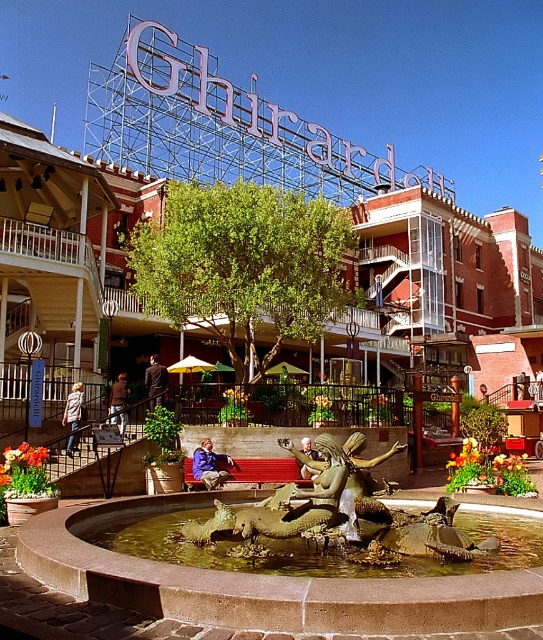
Who is higher up, red brick building at center or denim jacket at lower left?

red brick building at center is above.

Where is `red brick building at center`? red brick building at center is located at coordinates (72, 252).

In the scene shown: Is dark brown leather jacket at center to the left of brown leather jacket at lower center from the viewer's perspective?

No, dark brown leather jacket at center is not to the left of brown leather jacket at lower center.

Is dark brown leather jacket at center above brown leather jacket at lower center?

Yes, dark brown leather jacket at center is above brown leather jacket at lower center.

Does point (167, 378) come in front of point (118, 390)?

No, it is behind (118, 390).

What are the coordinates of `dark brown leather jacket at center` in the screenshot? It's located at (155, 380).

Which is more to the right, denim jacket at lower left or smooth leather jacket at center?

Positioned to the right is smooth leather jacket at center.

Who is more distant from viewer, (66, 417) or (301, 440)?

The point (66, 417) is more distant.

Identify the location of denim jacket at lower left. point(73,406).